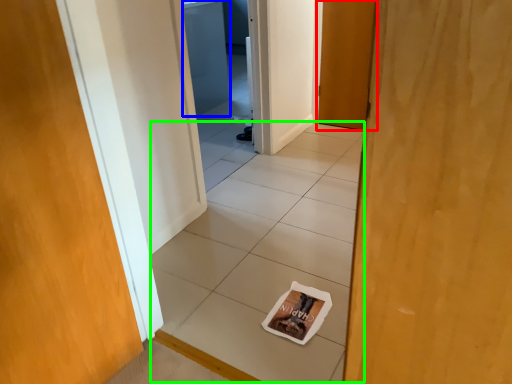
Question: Which object is positioned farthest from door (highlighted by a red box)? Select from screen door (highlighted by a blue box) and tile (highlighted by a green box).

Choices:
 (A) screen door
 (B) tile

Answer: (A)